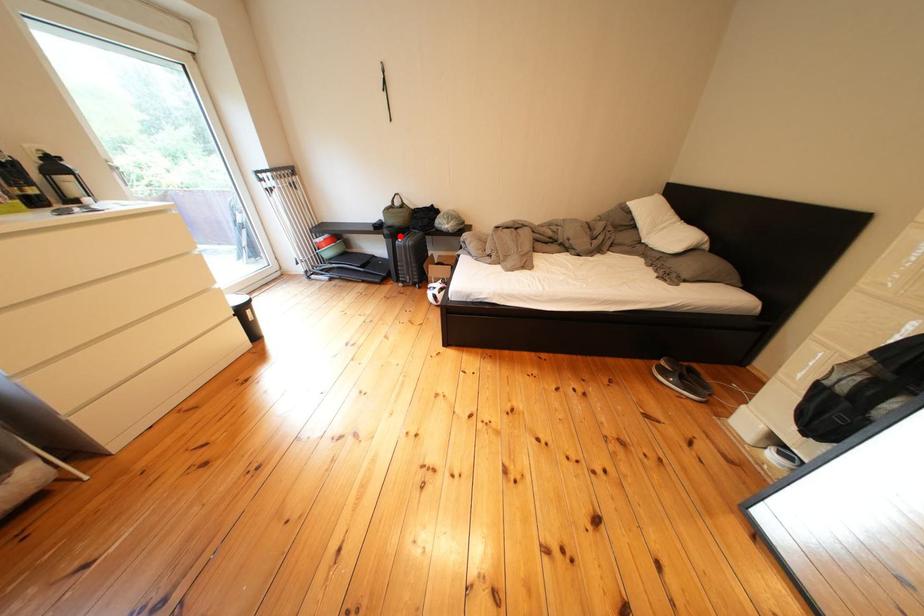
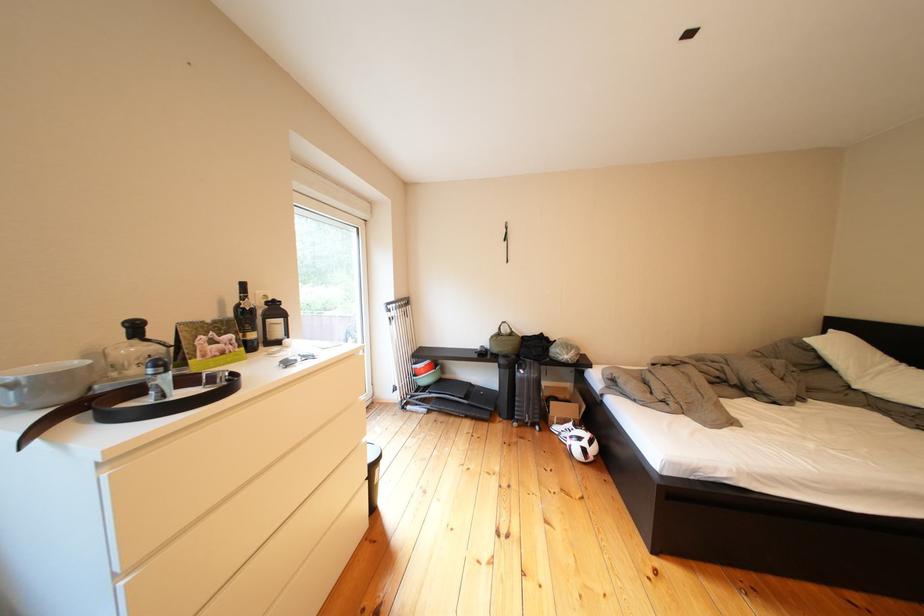
Question: I am providing you with two images of the same scene from different viewpoints. Image1 has a red point marked. In image2, the corresponding 3D location appears at what relative position? Reply with the corresponding letter.

Choices:
 (A) Closer
 (B) Farther

Answer: (B)